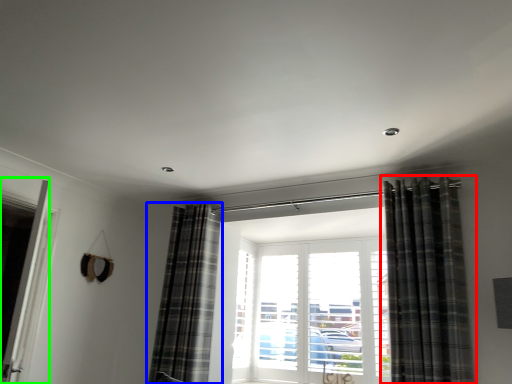
Question: Considering the real-world distances, which object is closest to curtain (highlighted by a red box)? curtain (highlighted by a blue box) or screen door (highlighted by a green box).

Choices:
 (A) curtain
 (B) screen door

Answer: (A)